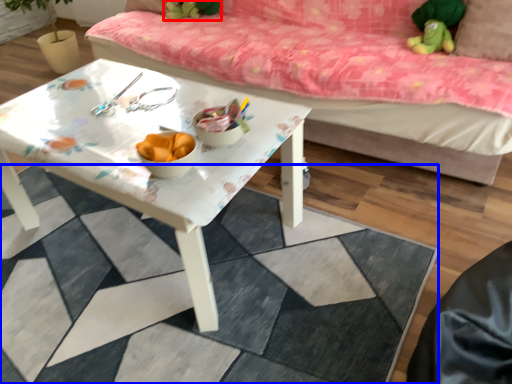
Question: Which point is closer to the camera, toy (highlighted by a red box) or tile (highlighted by a blue box)?

Choices:
 (A) toy
 (B) tile

Answer: (B)